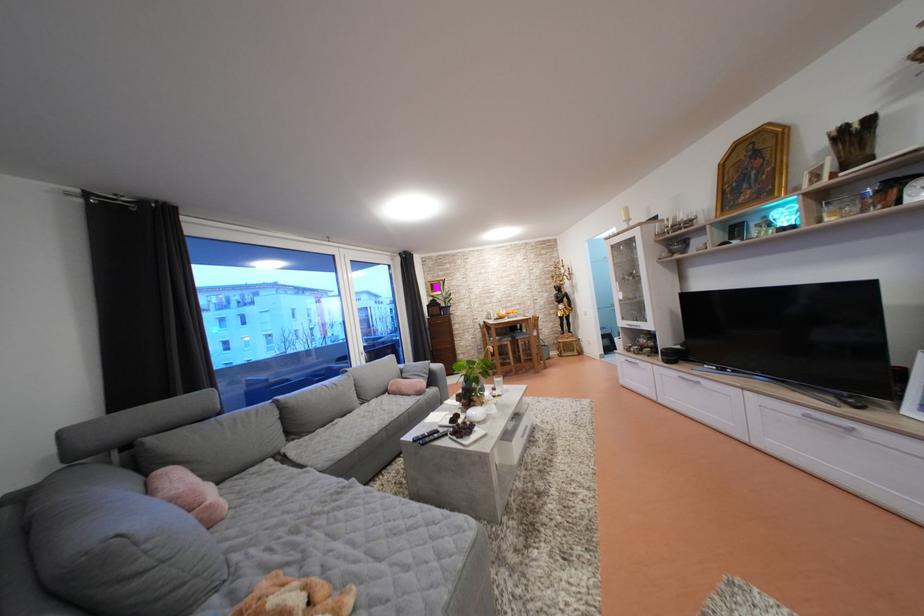
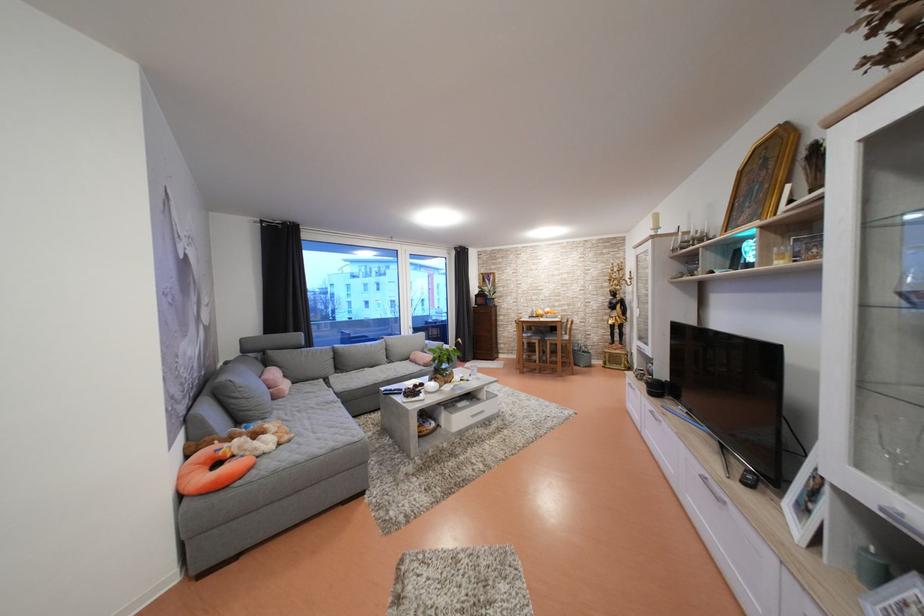
In the second image, find the point that corresponds to point (427, 399) in the first image.

(432, 370)